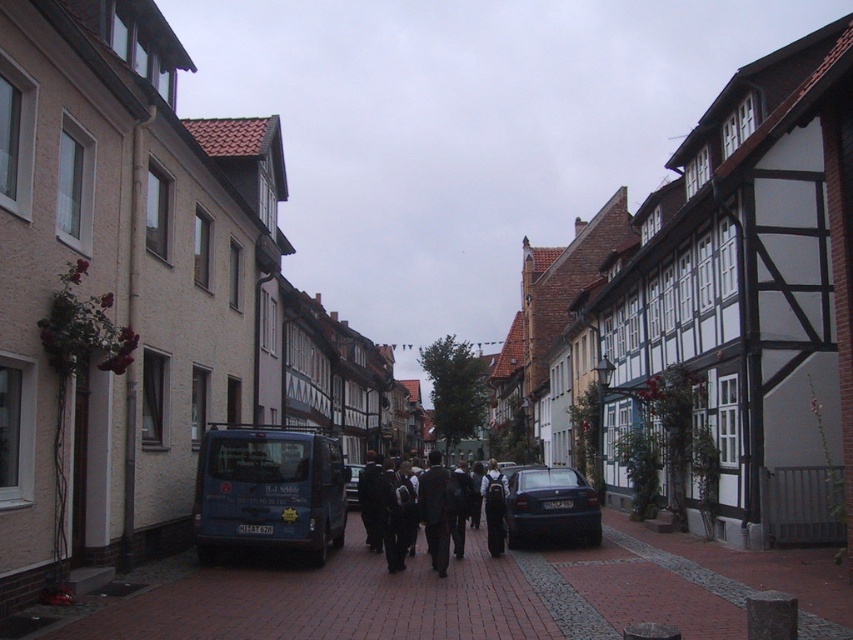
Does point (329, 486) lie in front of point (502, 552)?

Yes, point (329, 486) is closer to viewer.

Is point (277, 470) positioned behind point (502, 538)?

No, it is not.

Locate an element on the screen. blue metallic bus at center is located at coordinates (268, 490).

Consider the image. Is shiny dark blue sedan at center further to the viewer compared to dark gray backpack at center?

That is True.

Which is in front, point (567, 476) or point (502, 536)?

Positioned in front is point (502, 536).

The height and width of the screenshot is (640, 853). I want to click on shiny dark blue sedan at center, so tap(550, 506).

Between point (740, 609) and point (259, 452), which one is positioned in front?

Point (740, 609) is more forward.

Does brick pavement at center appear under blue metallic bus at center?

Yes.

Who is more forward, (270, 598) or (273, 524)?

Positioned in front is point (270, 598).

Locate an element on the screen. The height and width of the screenshot is (640, 853). brick pavement at center is located at coordinates (488, 595).